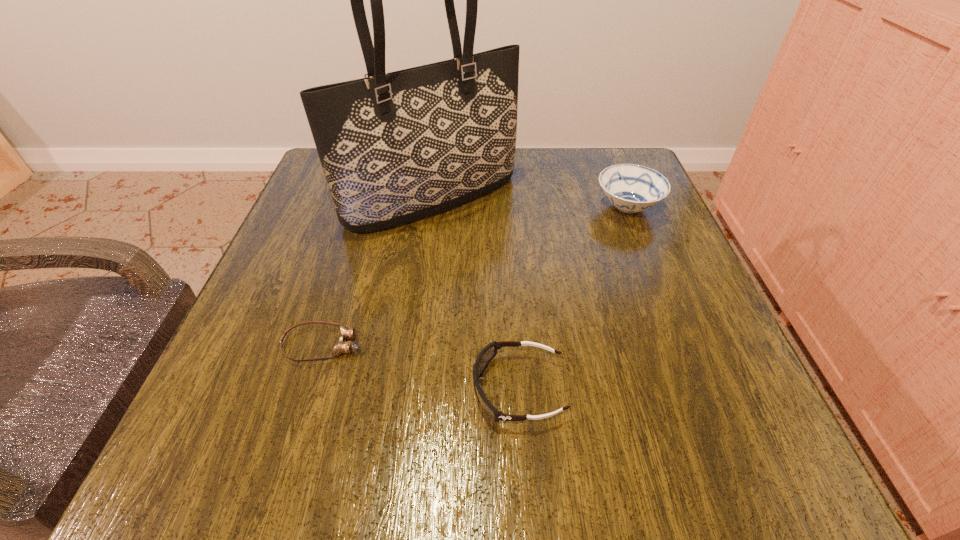
Locate an element on the screen. vacant area located on the front and sides of the taller goggles is located at coordinates (260, 389).

Identify the location of vacant space located 0.180m on the front and sides of the taller goggles. (349, 389).

This screenshot has height=540, width=960. Find the location of `vacant area located 0.100m on the front lenses and sides of the shorter goggles`. vacant area located 0.100m on the front lenses and sides of the shorter goggles is located at coordinates (426, 345).

Identify the location of tote bag present at the far edge. (396, 147).

This screenshot has width=960, height=540. In order to click on soup bowl that is at the far edge in this screenshot , I will do `click(631, 188)`.

In order to click on object that is at the near edge in this screenshot , I will do `click(487, 353)`.

I want to click on tote bag that is positioned at the left edge, so click(396, 147).

The height and width of the screenshot is (540, 960). I want to click on goggles situated at the left edge, so click(x=342, y=346).

Image resolution: width=960 pixels, height=540 pixels. In order to click on object that is at the right edge in this screenshot , I will do `click(631, 188)`.

Find the location of `object positioned at the far left corner`. object positioned at the far left corner is located at coordinates [396, 147].